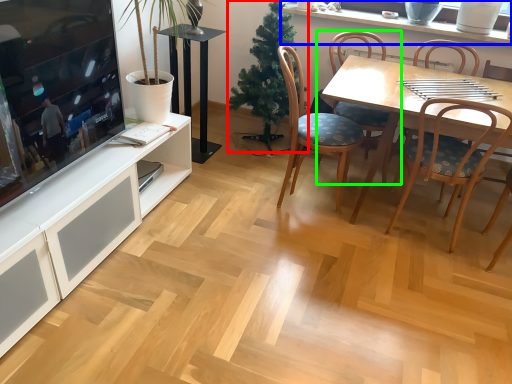
Question: Considering the real-world distances, which object is farthest from christmas tree (highlighted by a red box)? window sill (highlighted by a blue box) or chair (highlighted by a green box)?

Choices:
 (A) window sill
 (B) chair

Answer: (A)